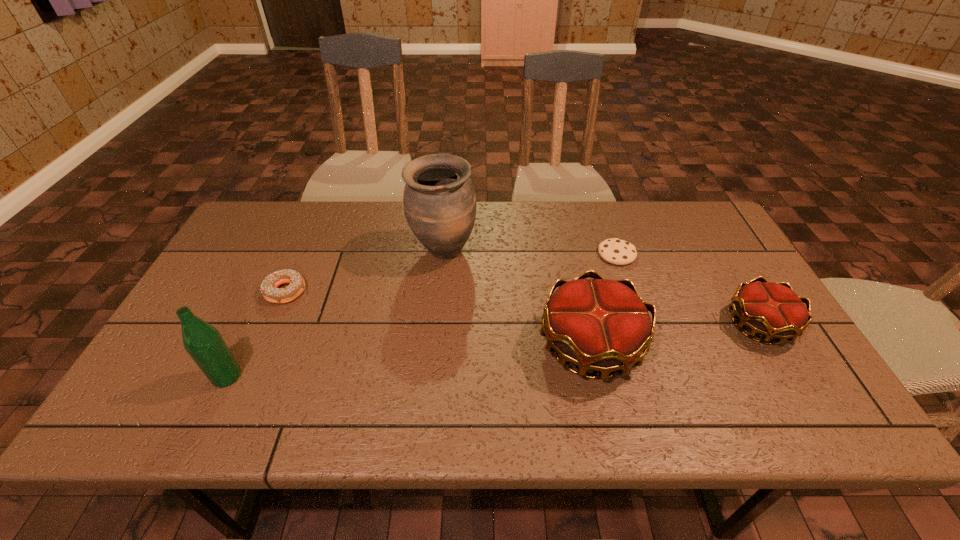
You are a GUI agent. You are given a task and a screenshot of the screen. Output one action in this format:
    pyautogui.click(x=<x>, y=<y>)
    Task: Click on the free space located 0.350m on the back of the shorter crown
    
    Given the screenshot: What is the action you would take?
    pyautogui.click(x=699, y=221)

What are the coordinates of `free space located 0.170m on the back of the doughnut` in the screenshot? It's located at (309, 239).

The image size is (960, 540). What are the coordinates of `vacant region located on the right of the cookie` in the screenshot? It's located at (686, 254).

Identify the location of vacant space located 0.130m on the right of the urn. (520, 251).

The image size is (960, 540). I want to click on vacant space located 0.070m on the back of the bottle, so click(x=244, y=340).

What are the coordinates of `cookie present at the far edge` in the screenshot? It's located at (616, 251).

At what (x,y) coordinates should I click in order to perform the action: click on urn that is at the far edge. Please return your answer as a coordinate pair (x, y). Looking at the image, I should click on (439, 200).

The height and width of the screenshot is (540, 960). Identify the location of crown that is at the near edge. (602, 325).

The height and width of the screenshot is (540, 960). In order to click on bottle that is at the near edge in this screenshot , I will do `click(203, 342)`.

This screenshot has width=960, height=540. I want to click on object that is at the left edge, so click(203, 342).